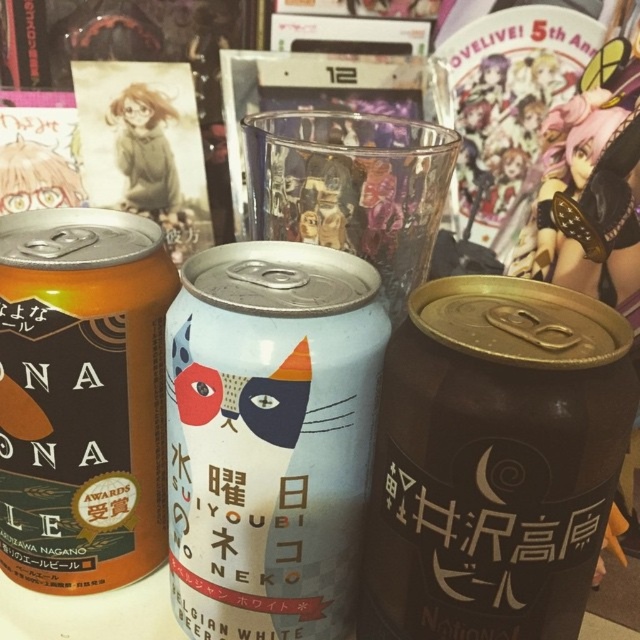
You are organizing a party and need to choose between the black matte can at center and the matte blue can at center for a display. Which can should you choose if you want the smaller one for a compact arrangement?

The black matte can at center has a smaller size compared to the matte blue can at center, so it is the better choice for a compact arrangement.

You are a customer at a cafe and want to grab the black matte can at center and the matte blue can at center. Which can should you reach for first to get the one closer to you?

The black matte can at center is closer to the viewer than the matte blue can at center, so you should reach for the black matte can at center first.

You are organizing a snack table for an anime convention and need to stack the black matte can at center and the matte blue can at center vertically. Which can should be placed at the bottom to ensure stability?

The black matte can at center has a lesser height compared to the matte blue can at center, so placing the taller matte blue can at center at the bottom would provide more stability for the stack.